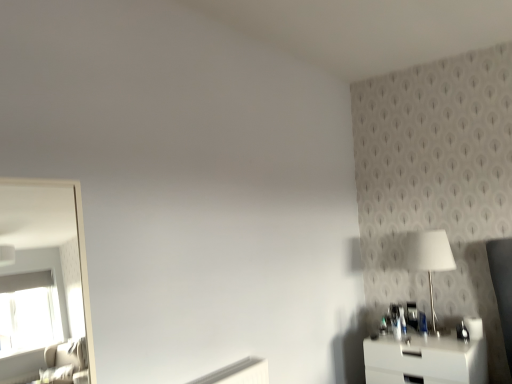
The height and width of the screenshot is (384, 512). Describe the element at coordinates (425, 360) in the screenshot. I see `white glossy nightstand at lower right` at that location.

Identify the location of white glossy nightstand at lower right. This screenshot has width=512, height=384. (425, 360).

What is the approximate height of white glossy nightstand at lower right?

white glossy nightstand at lower right is 17.77 inches in height.

The height and width of the screenshot is (384, 512). Describe the element at coordinates (429, 258) in the screenshot. I see `white glossy table lamp at right` at that location.

The height and width of the screenshot is (384, 512). What are the coordinates of `white glossy table lamp at right` in the screenshot? It's located at (429, 258).

Where is `white glossy nightstand at lower right`? The image size is (512, 384). white glossy nightstand at lower right is located at coordinates click(x=425, y=360).

Is white glossy nightstand at lower right at the right side of white glossy table lamp at right?

No.

Relative to white glossy table lamp at right, is white glossy nightstand at lower right in front or behind?

Clearly, white glossy nightstand at lower right is in front of white glossy table lamp at right.

Which is in front, point (438, 343) or point (429, 284)?

The point (438, 343) is closer to the camera.

From the image's perspective, is white glossy nightstand at lower right beneath white glossy table lamp at right?

Yes, from the image's perspective, white glossy nightstand at lower right is below white glossy table lamp at right.

From a real-world perspective, is white glossy nightstand at lower right positioned above or below white glossy table lamp at right?

Clearly, from a real-world perspective, white glossy nightstand at lower right is below white glossy table lamp at right.

Between white glossy nightstand at lower right and white glossy table lamp at right, which one has larger width?

With larger width is white glossy nightstand at lower right.

From their relative heights in the image, would you say white glossy nightstand at lower right is taller or shorter than white glossy table lamp at right?

A: white glossy nightstand at lower right is shorter than white glossy table lamp at right.

Considering the sizes of white glossy nightstand at lower right and white glossy table lamp at right in the image, is white glossy nightstand at lower right bigger or smaller than white glossy table lamp at right?

Considering their sizes, white glossy nightstand at lower right takes up more space than white glossy table lamp at right.

In the scene shown: Is white glossy table lamp at right located within white glossy nightstand at lower right?

No.

Is white glossy nightstand at lower right placed right next to white glossy table lamp at right?

They are not placed beside each other.

Is white glossy nightstand at lower right facing towards white glossy table lamp at right?

No, white glossy nightstand at lower right is not oriented towards white glossy table lamp at right.

I want to click on table lamp on the right of white glossy nightstand at lower right, so click(x=429, y=258).

Considering the positions of objects white glossy table lamp at right and white glossy nightstand at lower right in the image provided, who is more to the right, white glossy table lamp at right or white glossy nightstand at lower right?

white glossy table lamp at right.

Considering their positions, is white glossy table lamp at right located in front of or behind white glossy nightstand at lower right?

Clearly, white glossy table lamp at right is behind white glossy nightstand at lower right.

Considering the points (437, 257) and (364, 339), which point is in front, point (437, 257) or point (364, 339)?

The point (437, 257) is in front.

Based on the photo, from the image's perspective, is white glossy table lamp at right on top of white glossy nightstand at lower right?

Yes, from the image's perspective, white glossy table lamp at right is on top of white glossy nightstand at lower right.

From a real-world perspective, between white glossy table lamp at right and white glossy nightstand at lower right, who is vertically higher?

white glossy table lamp at right is physically above.

Does white glossy table lamp at right have a greater width compared to white glossy nightstand at lower right?

No, white glossy table lamp at right is not wider than white glossy nightstand at lower right.

In terms of height, does white glossy table lamp at right look taller or shorter compared to white glossy nightstand at lower right?

Clearly, white glossy table lamp at right is taller compared to white glossy nightstand at lower right.

Considering the relative sizes of white glossy table lamp at right and white glossy nightstand at lower right in the image provided, is white glossy table lamp at right bigger than white glossy nightstand at lower right?

No.

Is white glossy table lamp at right situated inside white glossy nightstand at lower right or outside?

white glossy table lamp at right exists outside the volume of white glossy nightstand at lower right.

Is white glossy table lamp at right next to white glossy nightstand at lower right?

They are not placed beside each other.

Is white glossy table lamp at right oriented towards white glossy nightstand at lower right?

No, white glossy table lamp at right is not oriented towards white glossy nightstand at lower right.

How different are the orientations of white glossy table lamp at right and white glossy nightstand at lower right in degrees?

There is a 0.987-degree angle between the facing directions of white glossy table lamp at right and white glossy nightstand at lower right.

How distant is white glossy table lamp at right from white glossy nightstand at lower right?

They are 44.36 centimeters apart.

This screenshot has width=512, height=384. In order to click on table lamp on the right of the white glossy nightstand at lower right in this screenshot , I will do `click(429, 258)`.

This screenshot has width=512, height=384. I want to click on table lamp lying above the white glossy nightstand at lower right (from the image's perspective), so click(429, 258).

The image size is (512, 384). I want to click on nightstand lying on the left of white glossy table lamp at right, so 425,360.